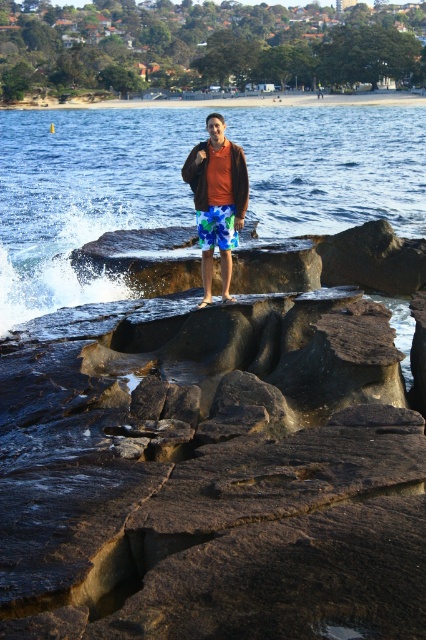
Question: Can you confirm if clear blue water at center is smaller than blue printed fabric shorts at center?

Choices:
 (A) yes
 (B) no

Answer: (B)

Question: Which point is closer to the camera taking this photo?

Choices:
 (A) click(x=259, y=152)
 (B) click(x=233, y=228)

Answer: (B)

Question: Which point is closer to the camera?

Choices:
 (A) brown rock at center
 (B) clear blue water at center

Answer: (A)

Question: Which point is farther to the camera?

Choices:
 (A) (204, 221)
 (B) (287, 412)

Answer: (A)

Question: Is clear blue water at center below matte brown jacket at center?

Choices:
 (A) yes
 (B) no

Answer: (B)

Question: Can you confirm if brown rock at center is thinner than clear blue water at center?

Choices:
 (A) yes
 (B) no

Answer: (A)